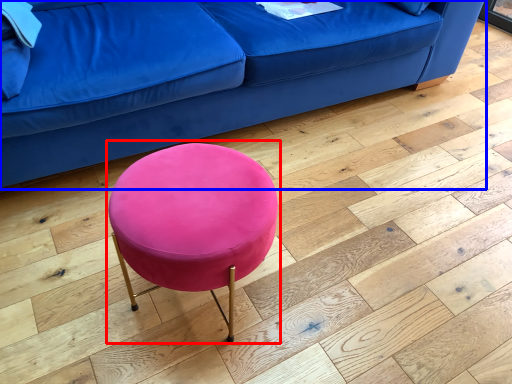
Question: Which object appears closest to the camera in this image, bar stool (highlighted by a red box) or studio couch (highlighted by a blue box)?

Choices:
 (A) bar stool
 (B) studio couch

Answer: (A)